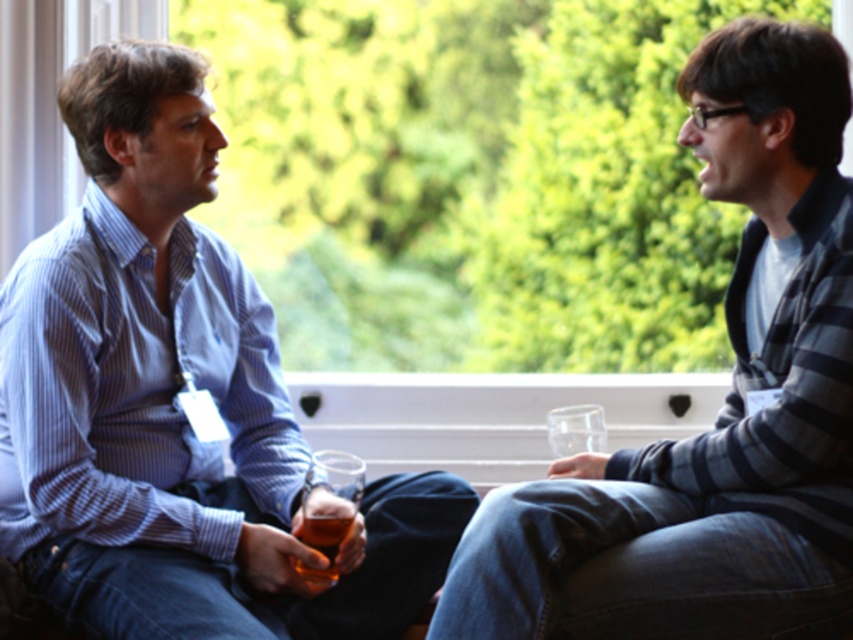
From the picture: You are a photographer setting up a shoot in this scene. You need to ensure that the matte blue shirt at left and the translucent glass beer at lower center are both visible in the frame. Given their sizes, which object will require a wider angle to capture fully?

The matte blue shirt at left is wider than the translucent glass beer at lower center, so the matte blue shirt at left will require a wider angle to capture fully.

You are a photographer setting up a shot of the two people in the scene. You need to ensure that the striped sweater at right and the translucent glass beer at lower center are both in focus. Which object should you focus on first to ensure depth of field captures both?

The striped sweater at right is much taller than the translucent glass beer at lower center. To ensure both are in focus, you should focus on the taller object first, which is the striped sweater at right, as it requires a greater depth of field to capture details from a distance.

You are standing in front of the image and want to locate the matte blue shirt at left. Can you tell me its 2D coordinates in the image?

The 2D coordinates of the matte blue shirt at left are at point [173,404].